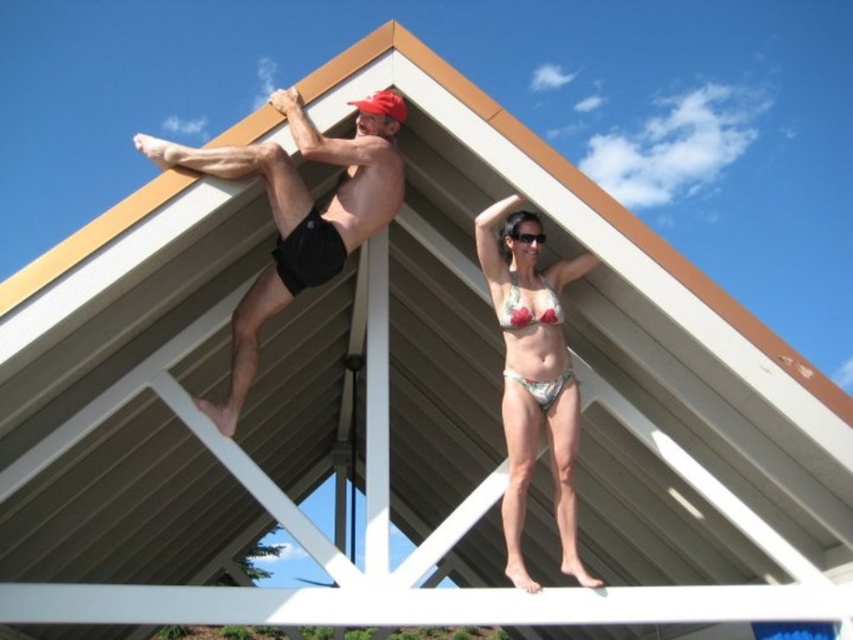
You are a photographer trying to capture the best shot of the two people on the roof. You need to ensure that both the floral bikini at upper right and the transparent plastic goggles at upper center are visible in the frame. Based on their positions, which object should you focus on first to include both in the shot?

The floral bikini at upper right is positioned under transparent plastic goggles at upper center. To include both in the shot, focus on the transparent plastic goggles at upper center first as it is above the floral bikini at upper right, ensuring the lower object remains in frame.

You are a drone operator trying to capture aerial footage of two people on a triangular roof. You need to ensure your drone stays above the two points marked as point (498, 314) and point (543, 240). Which point should you prioritize keeping the drone above to maintain a closer shot?

Point (498, 314) is closer to the viewer than point (543, 240), so you should prioritize keeping the drone above point (498, 314) to maintain a closer shot.